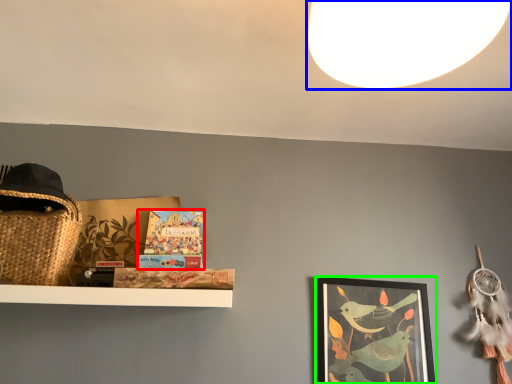
Question: Which is farther away from book (highlighted by a red box)? light (highlighted by a blue box) or picture frame (highlighted by a green box)?

Choices:
 (A) light
 (B) picture frame

Answer: (A)